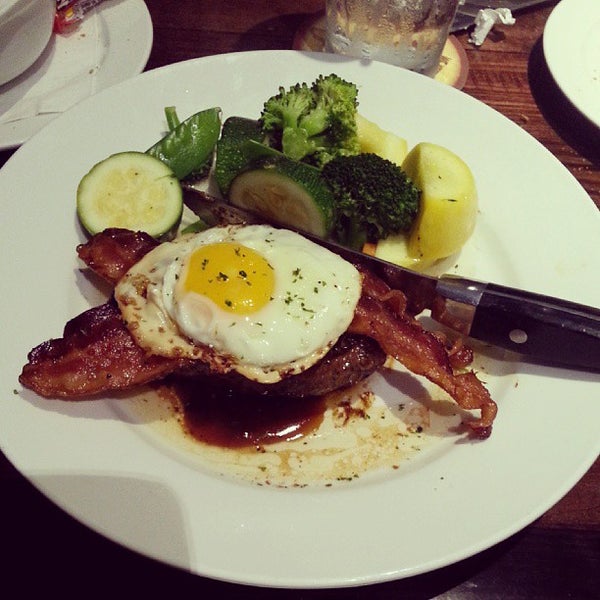
At what (x,y) coordinates should I click in order to perform the action: click on table. Please return your answer as a coordinate pair (x, y). The height and width of the screenshot is (600, 600). Looking at the image, I should click on pyautogui.click(x=519, y=83).